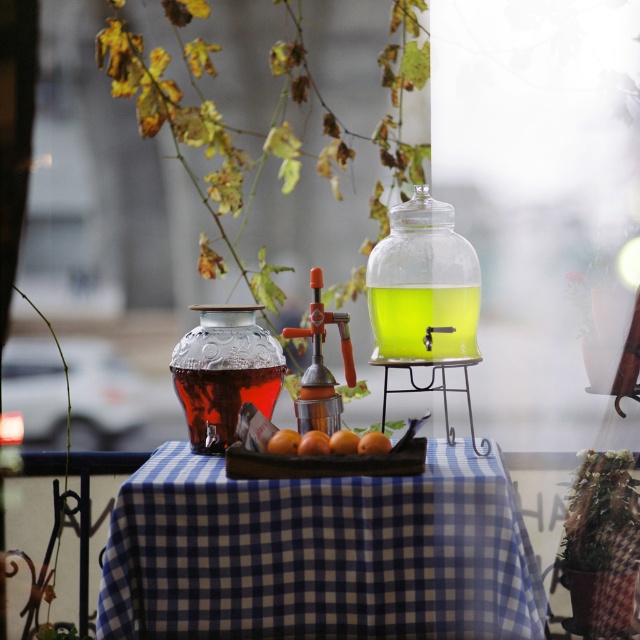
You are standing at the edge of the table and want to place a napkin on the blue checkered tablecloth at center. Given that the point coordinates are normalized between 0 and 1, where 0 is the bottom left corner and 1 is the top right corner, can you determine if the point at (320, 554) is on the blue checkered tablecloth at center?

Yes, the point at (320, 554) corresponds to the blue checkered tablecloth at center according to the description.